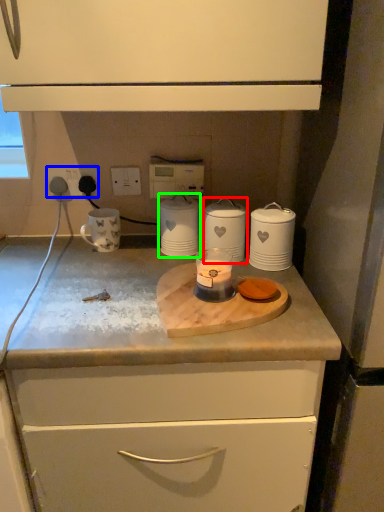
Question: Which object is positioned farthest from home appliance (highlighted by a red box)? Select from electric outlet (highlighted by a blue box) and home appliance (highlighted by a green box).

Choices:
 (A) electric outlet
 (B) home appliance

Answer: (A)